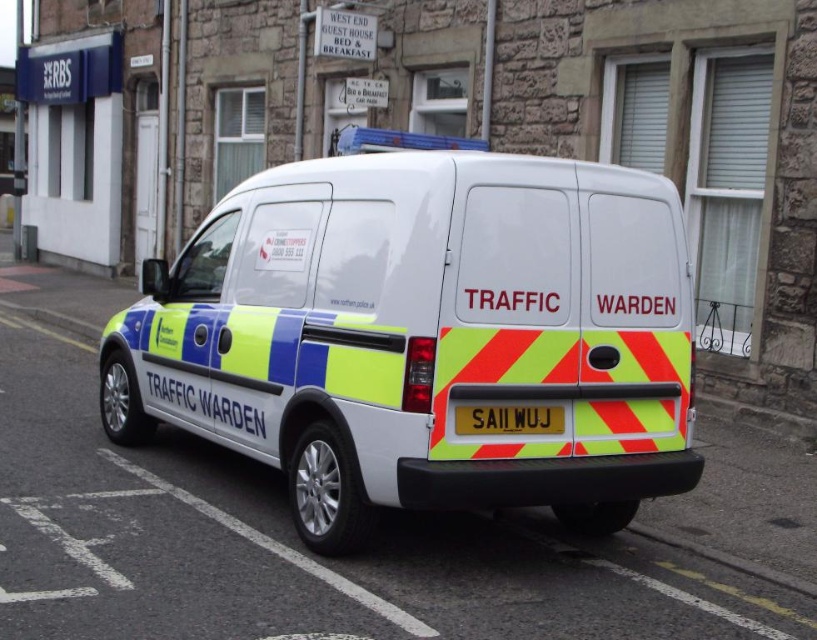
You are a delivery person needing to park your 1.5 meter long bike between the white glossy van at center and the yellow reflective plate at rear. Is there enough space?

The distance between the white glossy van at center and the yellow reflective plate at rear is 1.01 meters, which is less than the 1.5 meter length of your bike. Therefore, there is not enough space to park your bike between them.

You are a traffic warden trying to park your white glossy van at center in a designated parking spot. The parking spot has a center at point 0.527, 0.520. Is your van already correctly parked in the center of the spot?

The position of white glossy van at center is at point (423, 337), so yes, the van is correctly parked in the center of the parking spot.

What is the location of the point with coordinates (423, 337) in the image?

The point with coordinates (423, 337) is on the white glossy van at center.